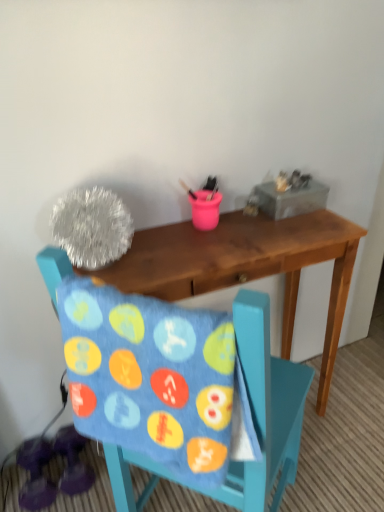
Identify the location of blue fabric chair at center. This screenshot has width=384, height=512. (265, 409).

Measure the distance between point (x=141, y=459) and camera.

Point (x=141, y=459) and camera are 38.58 inches apart from each other.

The width and height of the screenshot is (384, 512). What do you see at coordinates (265, 409) in the screenshot? I see `blue fabric chair at center` at bounding box center [265, 409].

The image size is (384, 512). In order to click on blue fabric chair at center in this screenshot , I will do tap(265, 409).